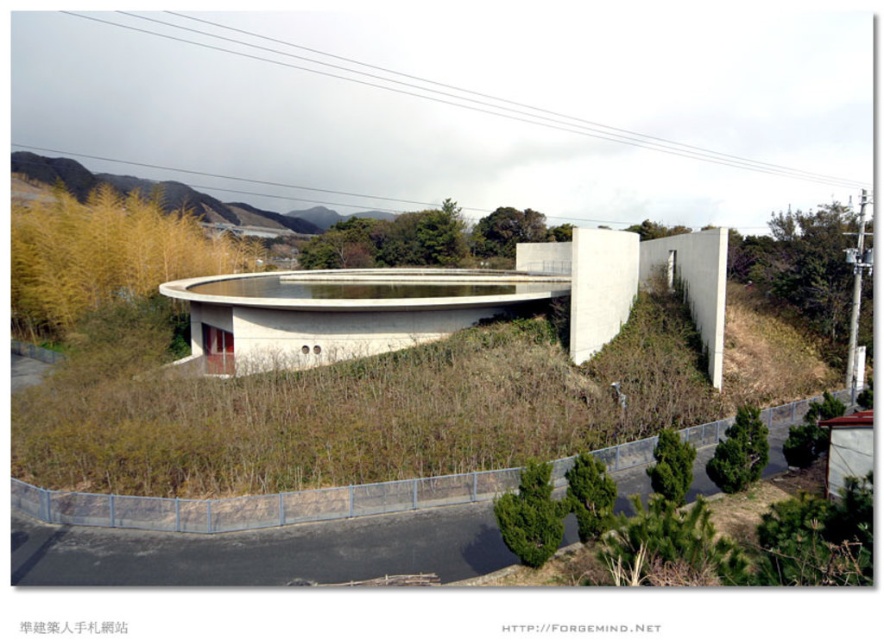
Is green matte grass at center positioned before smooth concrete overpass at center?

Yes, it is in front of smooth concrete overpass at center.

Which is in front, point (424, 406) or point (375, 304)?

Point (424, 406) is more forward.

Who is more forward, (314, 468) or (667, 266)?

Point (314, 468) is more forward.

What are the coordinates of `green matte grass at center` in the screenshot? It's located at (397, 406).

Between point (151, 435) and point (180, 195), which one is positioned in front?

Point (151, 435)

Between green matte grass at center and yellow grass at upper left, which one appears on the right side from the viewer's perspective?

Positioned to the right is green matte grass at center.

Does point (32, 417) come closer to viewer compared to point (252, 205)?

Yes, it is.

This screenshot has height=640, width=884. I want to click on green matte grass at center, so [x=397, y=406].

Is smooth concrete overpass at center behind yellow grass at upper left?

No, smooth concrete overpass at center is closer to the viewer.

Is point (277, 275) positioned in front of point (50, 164)?

That is True.

Is point (391, 324) closer to viewer compared to point (173, 208)?

Yes, it is in front of point (173, 208).

You are a GUI agent. You are given a task and a screenshot of the screen. Output one action in this format:
    pyautogui.click(x=<x>, y=<y>)
    Task: Click on the smooth concrete overpass at center
    Image resolution: width=884 pixels, height=640 pixels.
    Given the screenshot: What is the action you would take?
    pyautogui.click(x=451, y=300)